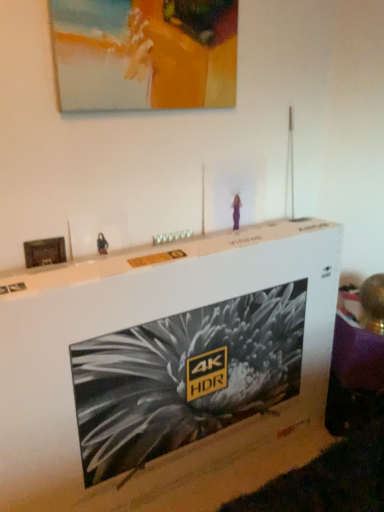
Question: From the image's perspective, is wooden frame at left, the second picture frame when ordered from right to left, located above or below white cardboard box at center?

Choices:
 (A) above
 (B) below

Answer: (A)

Question: Do you think wooden frame at left, which ranks as the 2th picture frame in top-to-bottom order, is within white cardboard box at center, or outside of it?

Choices:
 (A) outside
 (B) inside

Answer: (A)

Question: Based on their relative distances, which object is farther from the white cardboard box at center?

Choices:
 (A) matte acrylic painting at upper center, the 2th picture frame in the left-to-right sequence
 (B) wooden frame at left, which ranks as the 2th picture frame in top-to-bottom order

Answer: (A)

Question: Based on their relative distances, which object is farther from the white cardboard box at center?

Choices:
 (A) wooden frame at left, which is counted as the 1th picture frame, starting from the bottom
 (B) matte acrylic painting at upper center, positioned as the 1th picture frame in top-to-bottom order

Answer: (B)